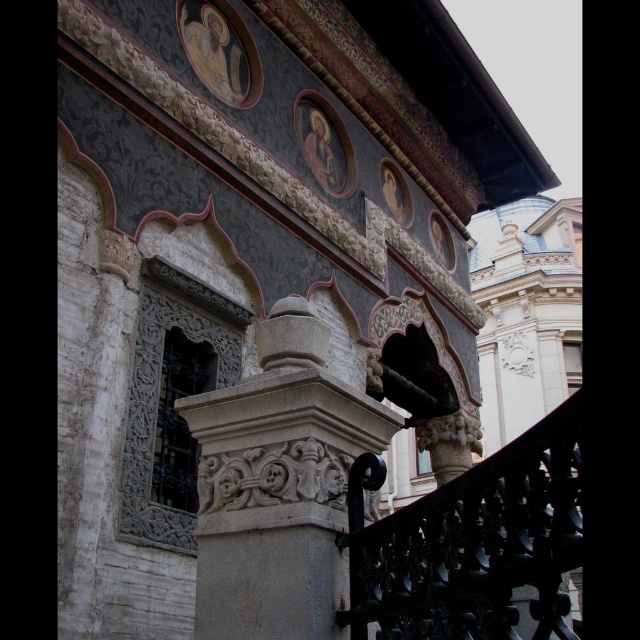
Question: Considering the relative positions of carved stone column at center and black wrought iron at lower right in the image provided, where is carved stone column at center located with respect to black wrought iron at lower right?

Choices:
 (A) right
 (B) left

Answer: (B)

Question: Which point is farther from the camera taking this photo?

Choices:
 (A) (381, 618)
 (B) (276, 412)

Answer: (B)

Question: Is carved stone column at center wider than black wrought iron at lower right?

Choices:
 (A) no
 (B) yes

Answer: (A)

Question: In this image, where is carved stone column at center located relative to black wrought iron at lower right?

Choices:
 (A) above
 (B) below

Answer: (A)

Question: Which of the following is the farthest from the observer?

Choices:
 (A) black wrought iron at lower right
 (B) carved stone column at center

Answer: (B)